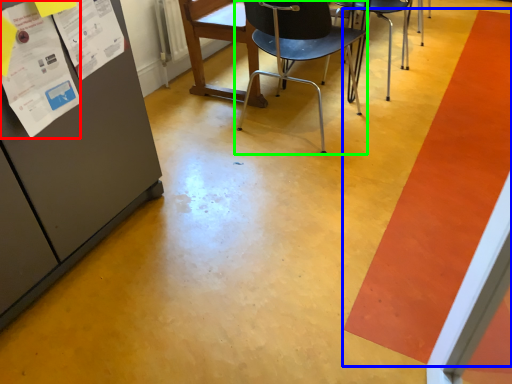
Question: Estimate the real-world distances between objects in this image. Which object is farther from poster (highlighted by a red box), strip (highlighted by a blue box) or chair (highlighted by a green box)?

Choices:
 (A) strip
 (B) chair

Answer: (A)